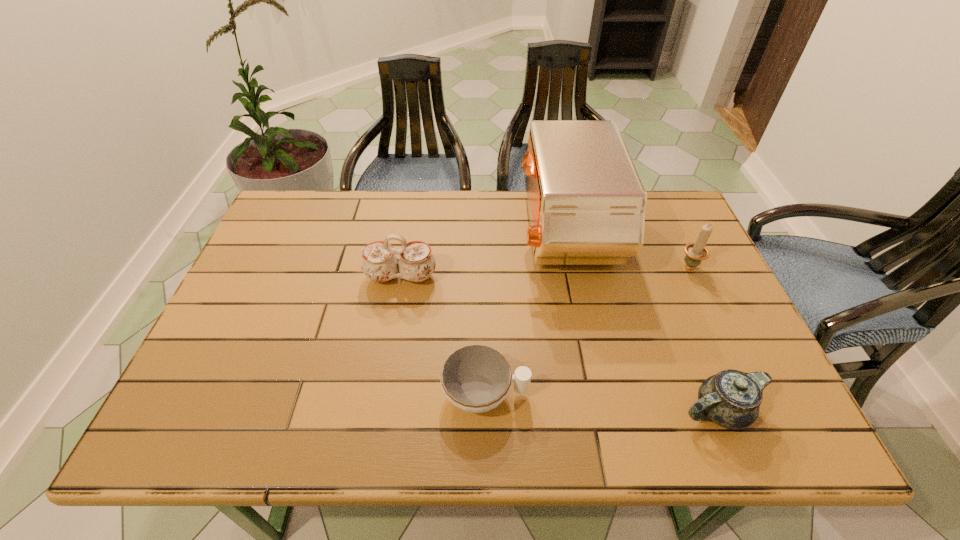
Locate an element on the screen. free spot between the candle_holder and the leftmost object is located at coordinates (544, 271).

Locate an element on the screen. Image resolution: width=960 pixels, height=540 pixels. free space between the farthest chinaware and the third object from left to right is located at coordinates (483, 255).

The image size is (960, 540). Find the location of `vacant area that lies between the second tallest chinaware and the tallest object`. vacant area that lies between the second tallest chinaware and the tallest object is located at coordinates (642, 322).

Where is `free space between the candle_holder and the rightmost chinaware`? The height and width of the screenshot is (540, 960). free space between the candle_holder and the rightmost chinaware is located at coordinates (704, 338).

At what (x,y) coordinates should I click in order to perform the action: click on vacant area that lies between the candle_holder and the second chinaware from left to right. Please return your answer as a coordinate pair (x, y). The width and height of the screenshot is (960, 540). Looking at the image, I should click on (587, 329).

Image resolution: width=960 pixels, height=540 pixels. I want to click on unoccupied area between the second tallest chinaware and the shortest object, so click(x=602, y=402).

The image size is (960, 540). I want to click on unoccupied position between the shortest chinaware and the tallest chinaware, so click(444, 335).

Select which object is the fourth closest to the leftmost chinaware. Please provide its 2D coordinates. Your answer should be formatted as a tuple, i.e. [(x, y)], where the tuple contains the x and y coordinates of a point satisfying the conditions above.

[(695, 252)]

Locate which object ranks third in proximity to the tallest chinaware. Please provide its 2D coordinates. Your answer should be formatted as a tuple, i.e. [(x, y)], where the tuple contains the x and y coordinates of a point satisfying the conditions above.

[(731, 399)]

Identify the location of the closest chinaware relative to the tallest object. (379, 263).